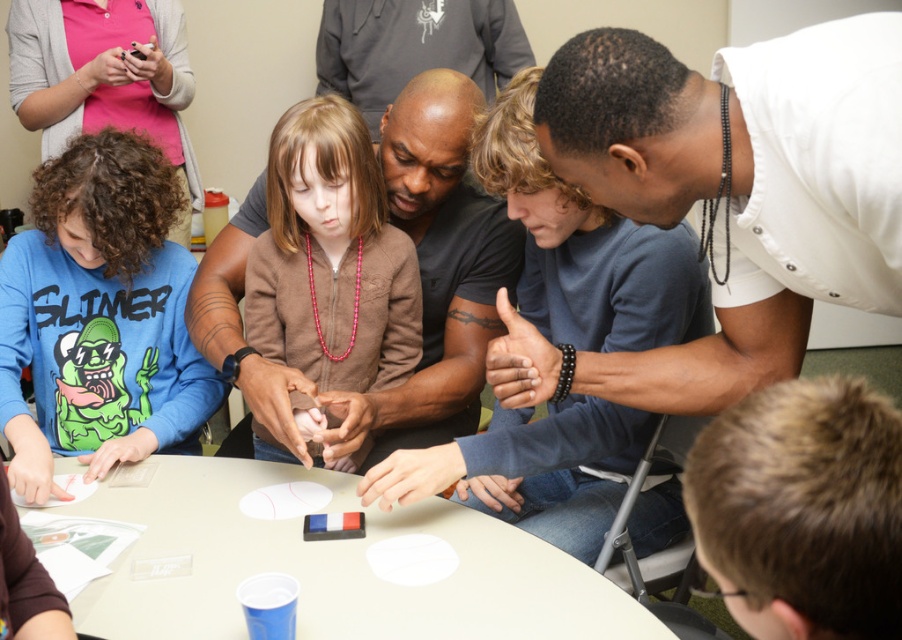
Is white plastic table at center further to camera compared to brown matte sweater at center?

No, it is not.

Who is more distant from viewer, (235, 628) or (336, 342)?

The point (336, 342) is more distant.

Where is `white plastic table at center`? Image resolution: width=902 pixels, height=640 pixels. white plastic table at center is located at coordinates (333, 566).

Can you confirm if smooth black shirt at center is positioned above brown matte sweater at center?

Indeed, smooth black shirt at center is positioned over brown matte sweater at center.

Does smooth black shirt at center lie in front of brown matte sweater at center?

Yes, it is.

Locate an element on the screen. Image resolution: width=902 pixels, height=640 pixels. smooth black shirt at center is located at coordinates (436, 269).

Can you confirm if blue cotton shirt at lower left is thinner than brown matte sweater at center?

In fact, blue cotton shirt at lower left might be wider than brown matte sweater at center.

Between point (62, 413) and point (354, 352), which one is positioned behind?

The point (62, 413) is more distant.

Is point (98, 269) in front of point (328, 140)?

No, (98, 269) is further to viewer.

Find the location of a particular element. blue cotton shirt at lower left is located at coordinates (99, 316).